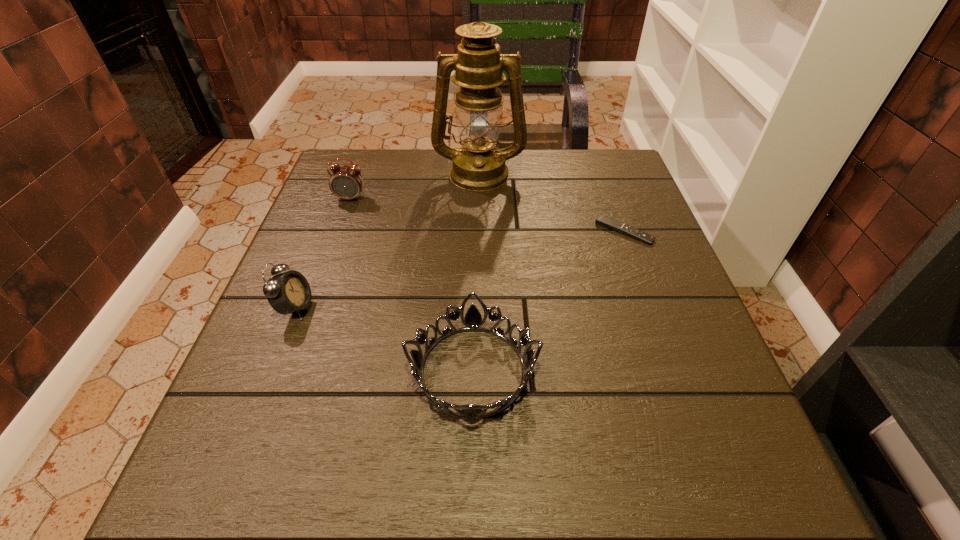
This screenshot has height=540, width=960. I want to click on free space located 0.150m on the front-facing side of the second shortest object, so click(x=624, y=370).

The image size is (960, 540). Find the location of `vacant space located 0.140m on the back of the shortest object`. vacant space located 0.140m on the back of the shortest object is located at coordinates (608, 186).

Image resolution: width=960 pixels, height=540 pixels. I want to click on oil lamp at the far edge, so click(x=478, y=165).

Find the location of a particular element. This screenshot has height=540, width=960. alarm clock at the far edge is located at coordinates (346, 182).

This screenshot has width=960, height=540. What are the coordinates of `object present at the right edge` in the screenshot? It's located at coord(602,220).

In order to click on object located at the far left corner in this screenshot , I will do `click(346, 182)`.

Identify the location of vacant region at the far edge of the desktop. The height and width of the screenshot is (540, 960). (410, 168).

In the image, there is a desktop. In order to click on free space at the near edge in this screenshot , I will do `click(516, 463)`.

What are the coordinates of `vacant space at the left edge of the desktop` in the screenshot? It's located at (343, 320).

Image resolution: width=960 pixels, height=540 pixels. In the image, there is a desktop. In order to click on vacant space at the right edge in this screenshot , I will do `click(655, 359)`.